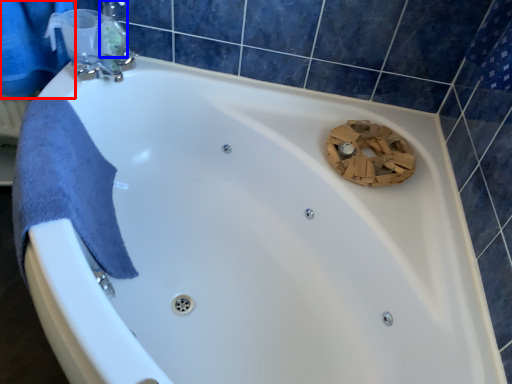
Question: Among these objects, which one is nearest to the camera, shower curtain (highlighted by a red box) or toiletry (highlighted by a blue box)?

Choices:
 (A) shower curtain
 (B) toiletry

Answer: (A)